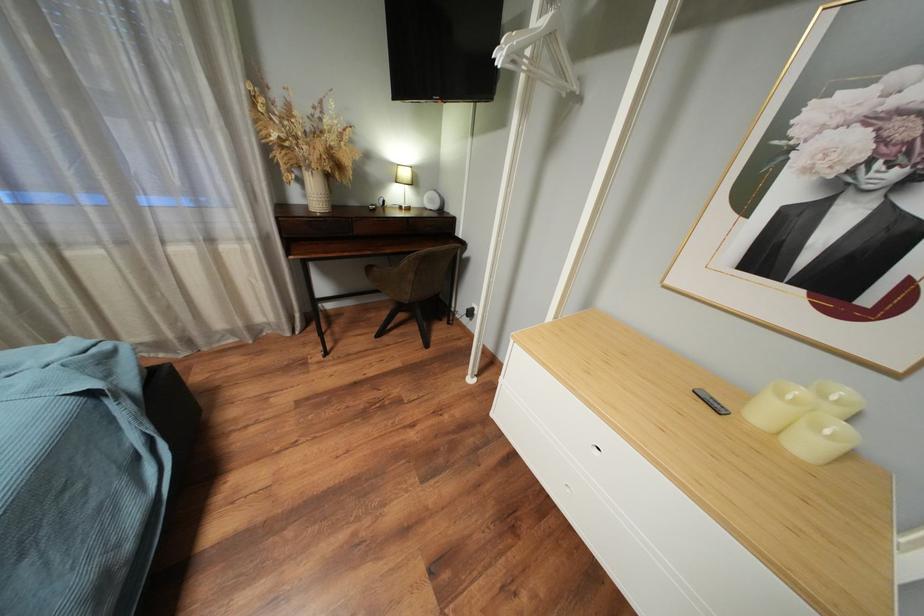
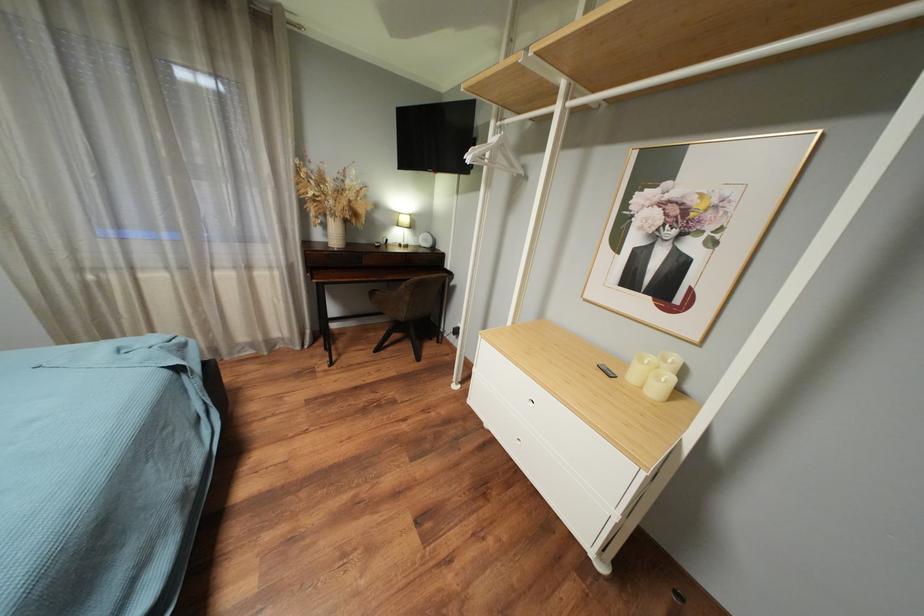
Question: The first image is from the beginning of the video and the second image is from the end. How did the camera likely rotate when shooting the video?

Choices:
 (A) Left
 (B) Right
 (C) Up
 (D) Down

Answer: (C)